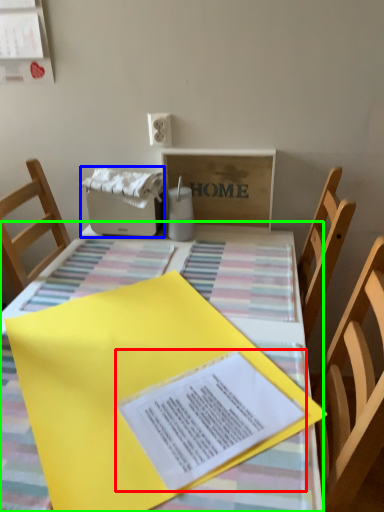
Question: Based on their relative distances, which object is nearer to journal (highlighted by a red box)? Choose from appliance (highlighted by a blue box) and table (highlighted by a green box).

Choices:
 (A) appliance
 (B) table

Answer: (B)